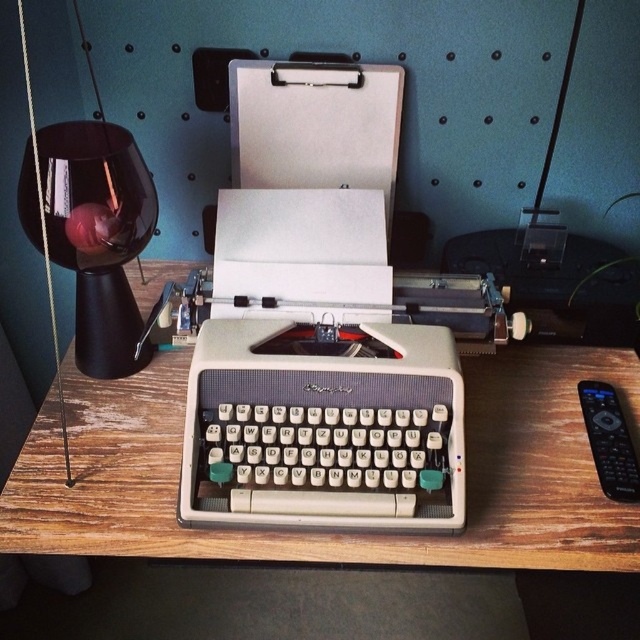
You are setting up a small desk area and need to place both the wooden table at center and the black plastic remote at right. Since you have limited space, which object should you prioritize placing first to ensure there is enough room for both?

The wooden table at center is bigger than the black plastic remote at right, so you should prioritize placing the wooden table at center first to ensure there is enough space for both objects.

You are setting up a workspace and need to place a black glass table lamp at left and a black plastic remote at right on a desk. The minimum required distance between them is 30 inches. Based on the scene description, will the current placement meet this requirement?

The black glass table lamp at left and black plastic remote at right are 33.61 inches apart, which exceeds the minimum required distance of 30 inches. Therefore, the current placement meets the requirement.